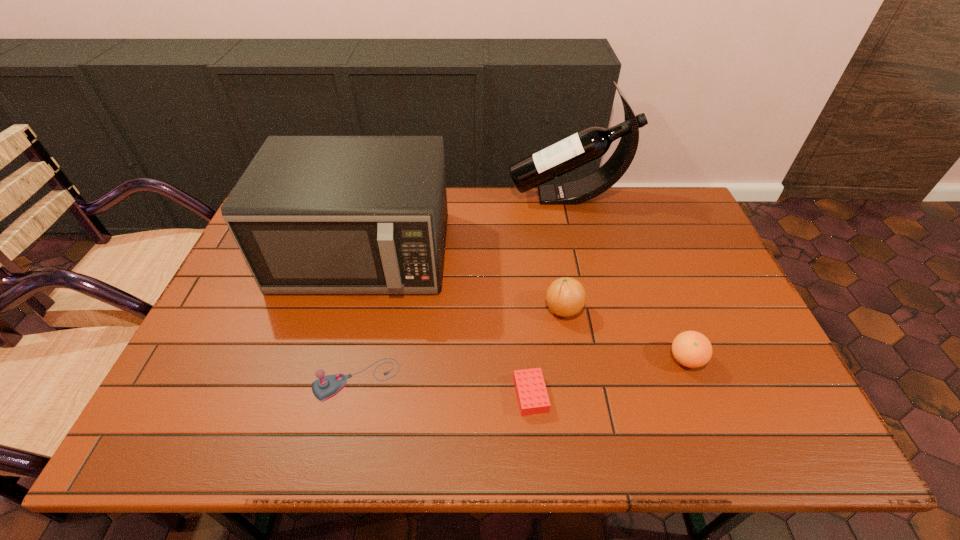
You are a GUI agent. You are given a task and a screenshot of the screen. Output one action in this format:
    pyautogui.click(x=<x>, y=<y>)
    Task: Click on the object present at the left edge
    
    Given the screenshot: What is the action you would take?
    pyautogui.click(x=311, y=214)

In order to click on object located at the right edge in this screenshot , I will do `click(692, 349)`.

This screenshot has height=540, width=960. Identify the location of object positioned at the far left corner. (311, 214).

You are a GUI agent. You are given a task and a screenshot of the screen. Output one action in this format:
    pyautogui.click(x=<x>, y=<y>)
    Task: Click on the vacant area at the far edge
    This screenshot has height=540, width=960.
    Given the screenshot: What is the action you would take?
    pyautogui.click(x=581, y=224)

Locate an element on the screen. The height and width of the screenshot is (540, 960). vacant space at the near edge is located at coordinates (494, 422).

This screenshot has height=540, width=960. I want to click on free space at the right edge of the desktop, so click(x=738, y=343).

In the image, there is a desktop. Find the location of `vacant space at the near left corner`. vacant space at the near left corner is located at coordinates (191, 428).

Where is `free location at the far right corner of the desktop`? free location at the far right corner of the desktop is located at coordinates (680, 201).

The width and height of the screenshot is (960, 540). Identify the location of free space between the shortest object and the fifth shortest object. (446, 324).

At what (x,y) coordinates should I click in order to perform the action: click on unoccupied area between the Lego and the taller orange. Please return your answer as a coordinate pair (x, y). This screenshot has height=540, width=960. Looking at the image, I should click on 547,352.